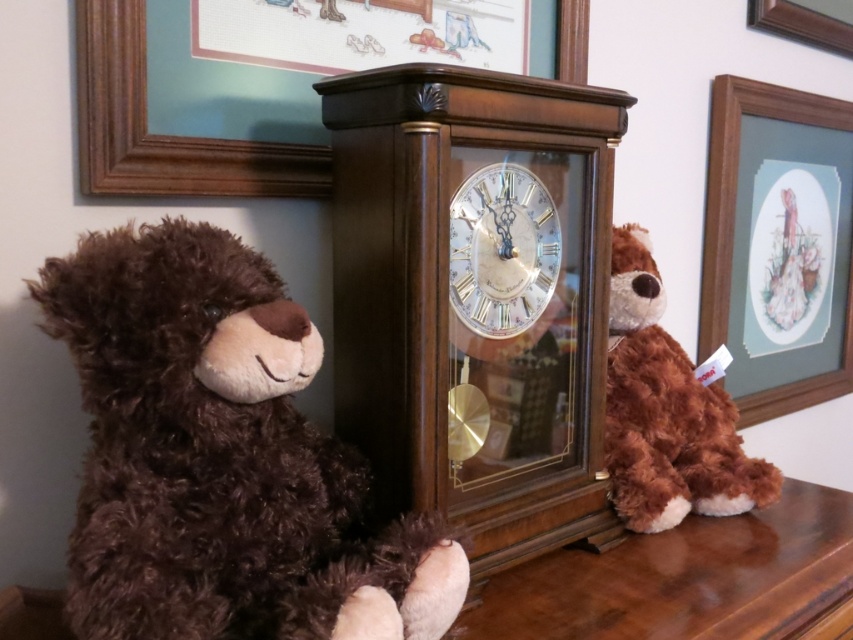
Is brown plush bear at left below wooden picture frame at upper center?

Correct, brown plush bear at left is located below wooden picture frame at upper center.

Based on the photo, between brown plush bear at left and wooden picture frame at upper center, which one appears on the right side from the viewer's perspective?

From the viewer's perspective, brown plush bear at left appears more on the right side.

Where is `brown plush bear at left`? brown plush bear at left is located at coordinates (219, 458).

Locate an element on the screen. brown plush bear at left is located at coordinates (219, 458).

In the scene shown: Does brown plush bear at left appear under wooden picture frame at upper right?

Yes, brown plush bear at left is below wooden picture frame at upper right.

From the picture: Can you confirm if brown plush bear at left is shorter than wooden picture frame at upper right?

Incorrect, brown plush bear at left's height does not fall short of wooden picture frame at upper right's.

Is point (178, 420) more distant than point (840, 4)?

No.

I want to click on brown plush bear at left, so click(x=219, y=458).

Is point (714, 429) positioned before point (518, 182)?

No, it is behind (518, 182).

Can you confirm if brown plush toy at right is positioned to the left of white glossy clock at center?

In fact, brown plush toy at right is to the right of white glossy clock at center.

Who is more distant from viewer, [726,449] or [486,186]?

Positioned behind is point [726,449].

The width and height of the screenshot is (853, 640). What are the coordinates of `brown plush toy at right` in the screenshot? It's located at (666, 412).